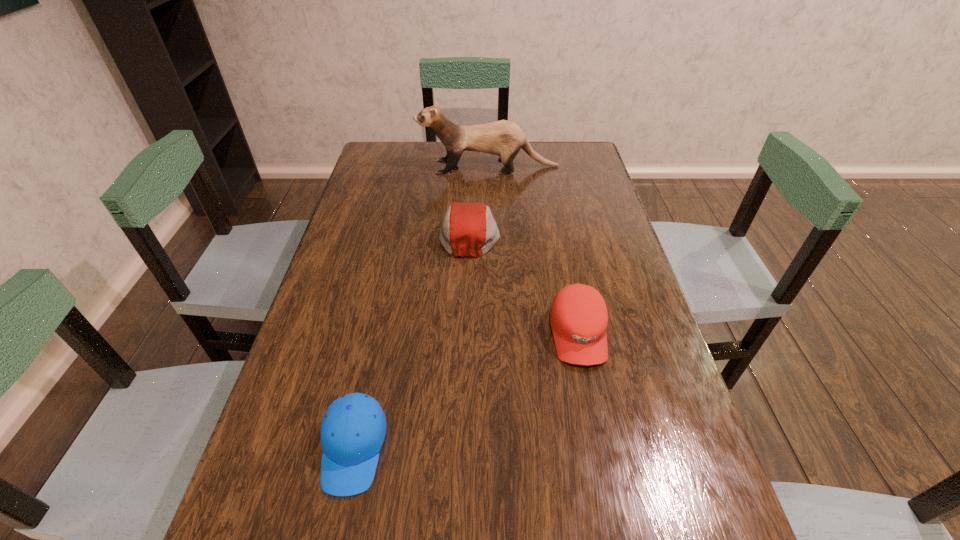
At what (x,y) coordinates should I click in order to perform the action: click on free space at the right edge. Please return your answer as a coordinate pair (x, y). The image size is (960, 540). Looking at the image, I should click on (612, 455).

Where is `free space at the far left corner of the desktop`? This screenshot has height=540, width=960. free space at the far left corner of the desktop is located at coordinates (404, 151).

The image size is (960, 540). I want to click on vacant area that lies between the rightmost cap and the ferret, so click(x=534, y=251).

This screenshot has height=540, width=960. I want to click on free space that is in between the leftmost cap and the ferret, so click(421, 307).

I want to click on vacant space that's between the second cap from left to right and the nearest object, so click(412, 341).

This screenshot has width=960, height=540. I want to click on free space between the second nearest cap and the farthest object, so click(x=534, y=251).

This screenshot has width=960, height=540. What are the coordinates of `vacant space in between the leftmost cap and the second farthest cap` in the screenshot? It's located at (466, 391).

Where is `empty space that is in between the second nearest object and the second farthest object`? The width and height of the screenshot is (960, 540). empty space that is in between the second nearest object and the second farthest object is located at coordinates (524, 284).

You are a GUI agent. You are given a task and a screenshot of the screen. Output one action in this format:
    pyautogui.click(x=<x>, y=<y>)
    Task: Click on the vacant area that lies between the rightmost cap and the leftmost cap
    
    Given the screenshot: What is the action you would take?
    pyautogui.click(x=466, y=391)

The image size is (960, 540). What are the coordinates of `free space between the ferret and the nearest cap` in the screenshot? It's located at (421, 307).